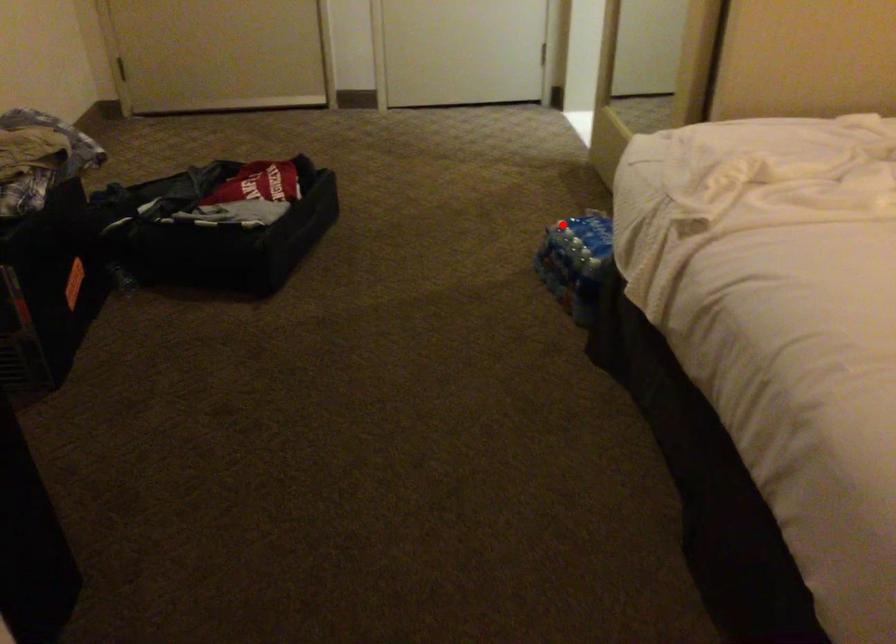
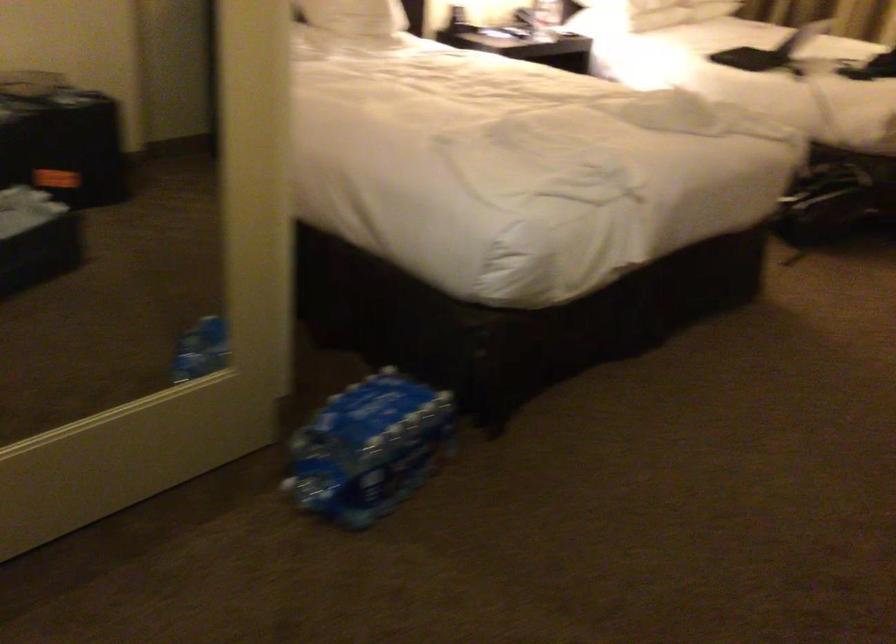
Question: I am providing you with two images of the same scene from different viewpoints. Image1 has a red point marked. In image2, the corresponding 3D location appears at what relative position? Reply with the corresponding letter.

Choices:
 (A) Closer
 (B) Farther

Answer: (A)